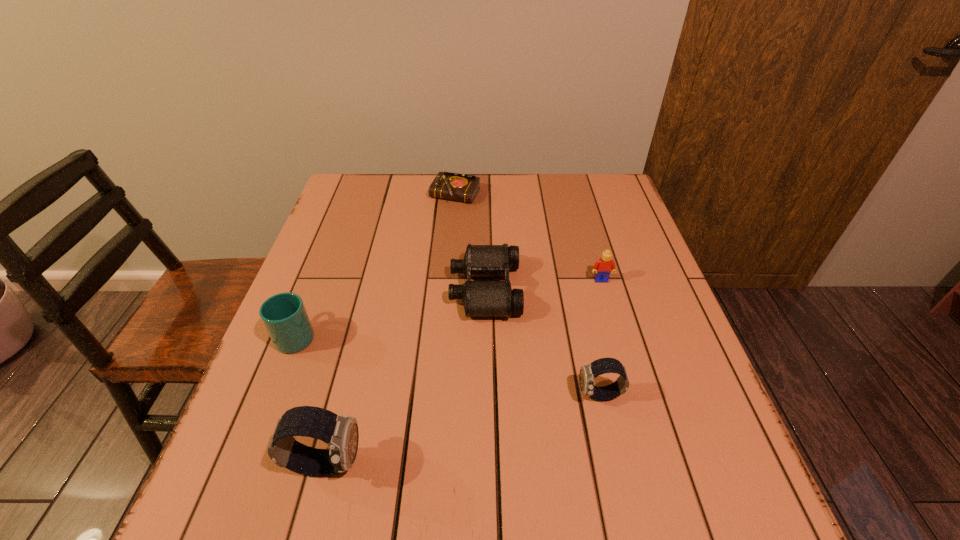
You are a GUI agent. You are given a task and a screenshot of the screen. Output one action in this format:
    pyautogui.click(x=<x>, y=<y>)
    Task: Click on the blank region between the Lego and the farther watch
    The width and height of the screenshot is (960, 540).
    Given the screenshot: What is the action you would take?
    pyautogui.click(x=600, y=338)

The image size is (960, 540). I want to click on vacant space that is in between the fifth farthest object and the Lego, so click(600, 338).

You are a GUI agent. You are given a task and a screenshot of the screen. Output one action in this format:
    pyautogui.click(x=<x>, y=<y>)
    Task: Click on the free space between the cup and the shorter watch
    
    Given the screenshot: What is the action you would take?
    pyautogui.click(x=448, y=365)

This screenshot has height=540, width=960. In order to click on object that is the third closest to the right watch in this screenshot , I will do `click(341, 434)`.

In order to click on the third closest object to the left watch in this screenshot , I will do `click(588, 373)`.

Locate an element on the screen. vacant space that satisfies the following two spatial constraints: 1. on the front-facing side of the Lego; 2. through the eyepieces of the binoculars is located at coordinates (604, 289).

This screenshot has width=960, height=540. What are the coordinates of `vacant space that satisfies the following two spatial constraints: 1. on the front-facing side of the Lego; 2. on the face of the fifth farthest object` in the screenshot? It's located at (635, 396).

Identify the location of vacant area in the image that satisfies the following two spatial constraints: 1. on the handle side of the cup; 2. on the right side of the shortest object. The width and height of the screenshot is (960, 540). (351, 195).

This screenshot has height=540, width=960. What are the coordinates of `vacant area that satisfies the following two spatial constraints: 1. on the front-facing side of the Lego; 2. through the eyepieces of the second shortest object` in the screenshot? It's located at coord(604,289).

The height and width of the screenshot is (540, 960). I want to click on vacant position in the image that satisfies the following two spatial constraints: 1. on the front-facing side of the Lego; 2. on the face of the nearest object, so click(x=655, y=463).